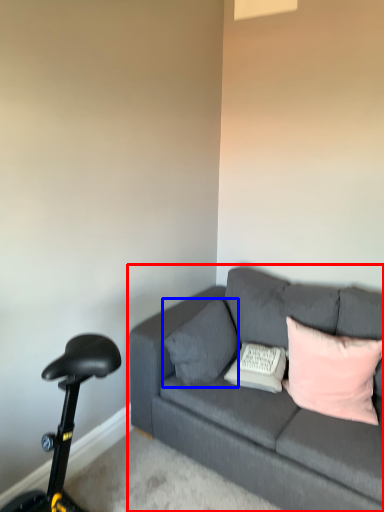
Question: Which point is further to the camera, studio couch (highlighted by a red box) or pillow (highlighted by a blue box)?

Choices:
 (A) studio couch
 (B) pillow

Answer: (B)